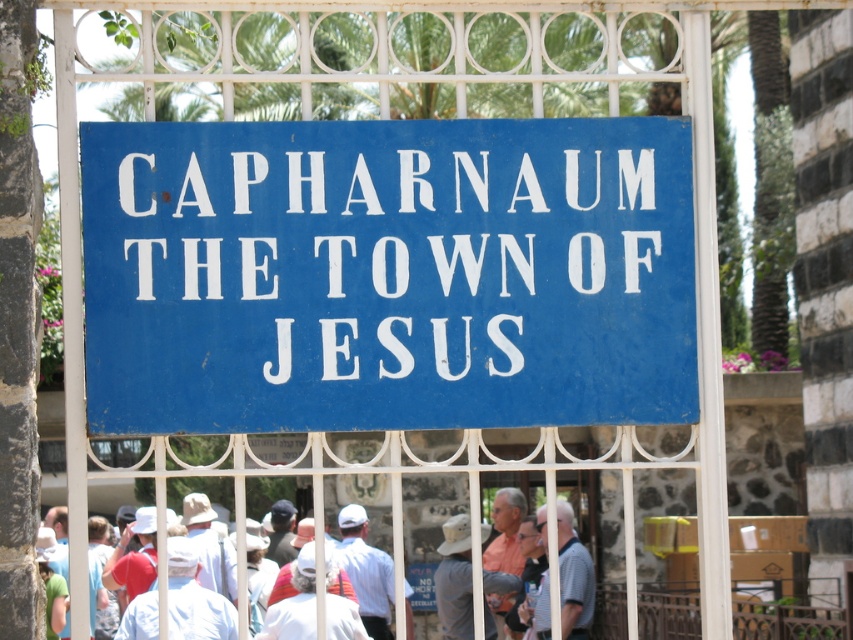
Which is behind, point (397, 388) or point (564, 541)?

The point (564, 541) is more distant.

Between point (695, 403) and point (575, 621), which one is positioned in front?

Point (695, 403) is in front.

Where is `blue painted metal sign at center`? blue painted metal sign at center is located at coordinates (387, 275).

Does light blue shirt at center appear under white cotton shirt at center?

No, light blue shirt at center is not below white cotton shirt at center.

Does light blue shirt at center appear on the left side of white cotton shirt at center?

In fact, light blue shirt at center is to the right of white cotton shirt at center.

Describe the element at coordinates (573, 577) in the screenshot. I see `light blue shirt at center` at that location.

At what (x,y) coordinates should I click in order to perform the action: click on light blue shirt at center. Please return your answer as a coordinate pair (x, y). Image resolution: width=853 pixels, height=640 pixels. Looking at the image, I should click on (573, 577).

Between blue painted metal sign at center and white cotton shirt at center, which one has less height?

white cotton shirt at center

Consider the image. Who is higher up, blue painted metal sign at center or white cotton shirt at center?

blue painted metal sign at center

Find the location of a particular element. This screenshot has height=640, width=853. blue painted metal sign at center is located at coordinates (387, 275).